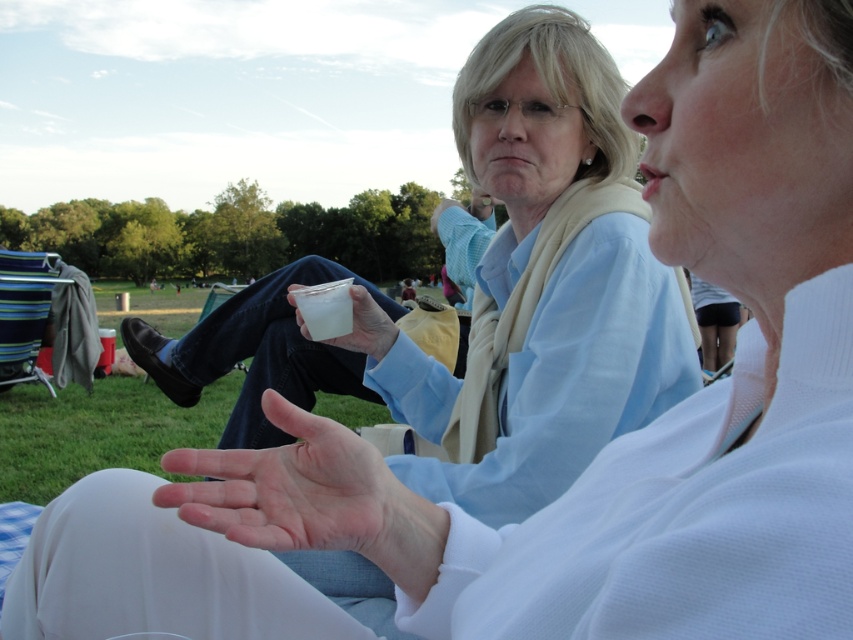
Does pale skin palm at center appear over translucent plastic cup at center?

No.

Does pale skin palm at center have a greater height compared to translucent plastic cup at center?

Yes, pale skin palm at center is taller than translucent plastic cup at center.

The image size is (853, 640). Find the location of `pale skin palm at center`. pale skin palm at center is located at coordinates (289, 486).

Between point (345, 468) and point (328, 323), which one is positioned behind?

Point (328, 323)

You are a GUI agent. You are given a task and a screenshot of the screen. Output one action in this format:
    pyautogui.click(x=<x>, y=<y>)
    Task: Click on the pale skin palm at center
    The image size is (853, 640).
    Given the screenshot: What is the action you would take?
    (x=289, y=486)

Does point (294, 417) come in front of point (341, 282)?

Yes, it is.

In order to click on pale skin palm at center in this screenshot , I will do `click(289, 486)`.

Who is lower down, translucent plastic cup at center or clear plastic cup at center?

Positioned lower is translucent plastic cup at center.

Which is above, translucent plastic cup at center or clear plastic cup at center?

clear plastic cup at center is higher up.

Who is more forward, [373,330] or [325,312]?

Point [325,312] is more forward.

I want to click on translucent plastic cup at center, so click(x=367, y=326).